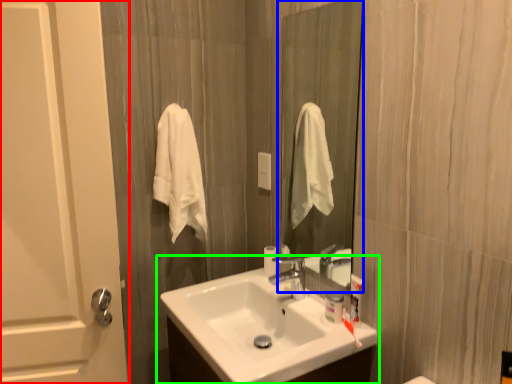
Question: Which object is positioned closest to door (highlighted by a red box)? Select from mirror (highlighted by a blue box) and sink (highlighted by a green box).

Choices:
 (A) mirror
 (B) sink

Answer: (B)